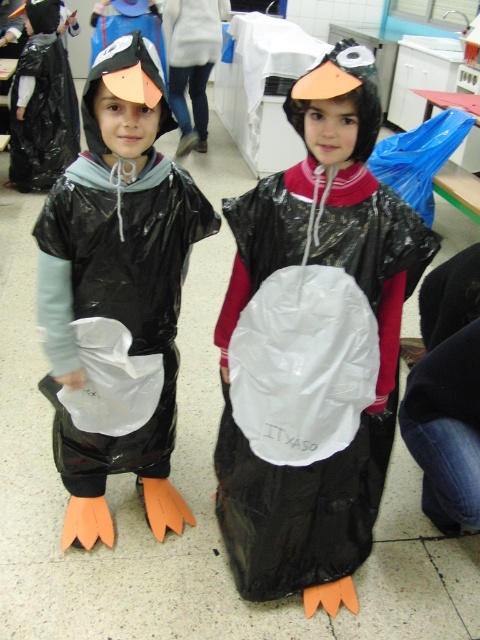
You are a photographer trying to capture a photo of both the matte black penguin costume at center and the matte black penguin at center. Given that your camera has a minimum focus distance of 12 inches, will you be able to focus on both subjects clearly at the same time?

The matte black penguin costume at center and matte black penguin at center are 11.62 inches apart, which is less than the camera minimum focus distance of 12 inches. Therefore, the camera cannot focus on both subjects clearly at the same time.

You are a teacher in the classroom and want to locate the point at coordinates (117, 294). Based on the scene description, where exactly is this point located?

The point at coordinates (117, 294) is on the matte black penguin costume at center.